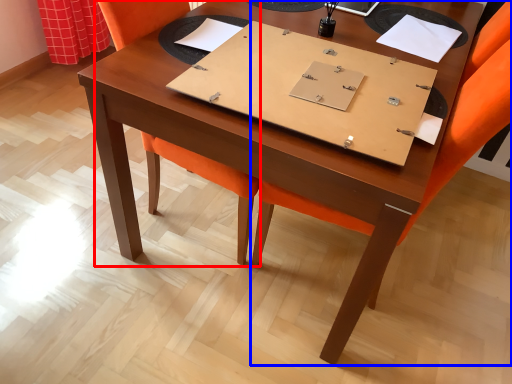
Question: Which of the following is the closest to the observer, swivel chair (highlighted by a red box) or chair (highlighted by a blue box)?

Choices:
 (A) swivel chair
 (B) chair

Answer: (B)